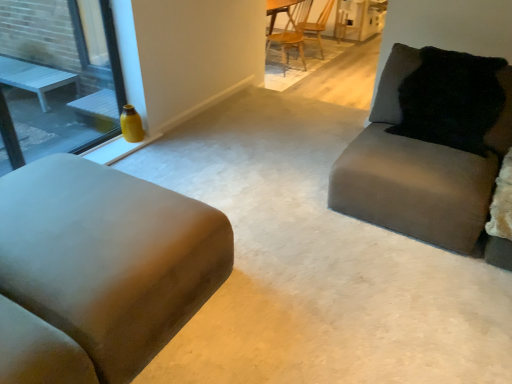
Question: In terms of width, does suede-like beige couch at left, the 2th studio couch positioned from the right, look wider or thinner when compared to wooden chair at upper center, marked as the 2th chair in a back-to-front arrangement?

Choices:
 (A) thin
 (B) wide

Answer: (B)

Question: Considering their positions, is suede-like beige couch at left, the 1th studio couch from the left, located in front of or behind wooden chair at upper center, the first chair when ordered from front to back?

Choices:
 (A) front
 (B) behind

Answer: (A)

Question: Estimate the real-world distances between objects in this image. Which object is closer to the wooden chair at upper center, the first chair when ordered from front to back?

Choices:
 (A) matte gray couch at right, acting as the 2th studio couch starting from the left
 (B) suede-like beige couch at left, the 1th studio couch from the left
 (C) black fuzzy pillow at upper right
 (D) matte yellow vase at left
 (E) wooden chair at center, arranged as the 1th chair when viewed from the back

Answer: (E)

Question: Considering the real-world distances, which object is closest to the matte gray couch at right, which appears as the first studio couch when viewed from the right?

Choices:
 (A) suede-like beige couch at left, the 1th studio couch from the left
 (B) black fuzzy pillow at upper right
 (C) wooden chair at upper center, the first chair when ordered from front to back
 (D) matte yellow vase at left
 (E) wooden chair at center, which appears as the 2th chair when viewed from the front

Answer: (B)